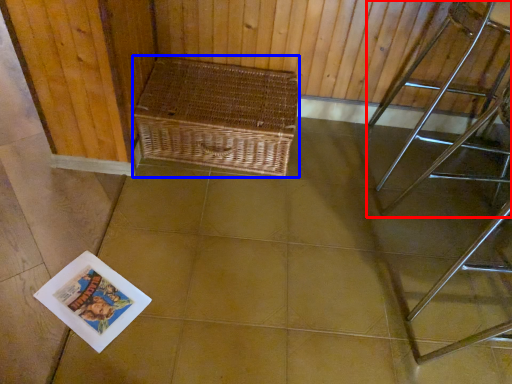
Question: Which of the following is the farthest to the observer, furniture (highlighted by a red box) or picnic basket (highlighted by a blue box)?

Choices:
 (A) furniture
 (B) picnic basket

Answer: (B)